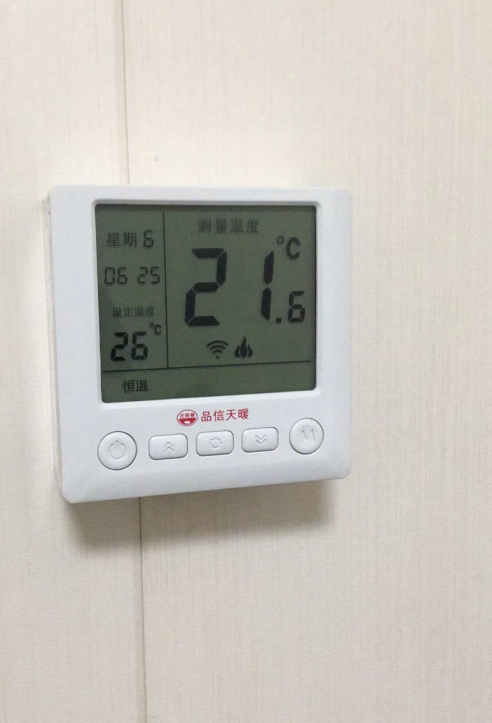
Where is `plastic cover`? The image size is (492, 723). plastic cover is located at coordinates (338, 393).